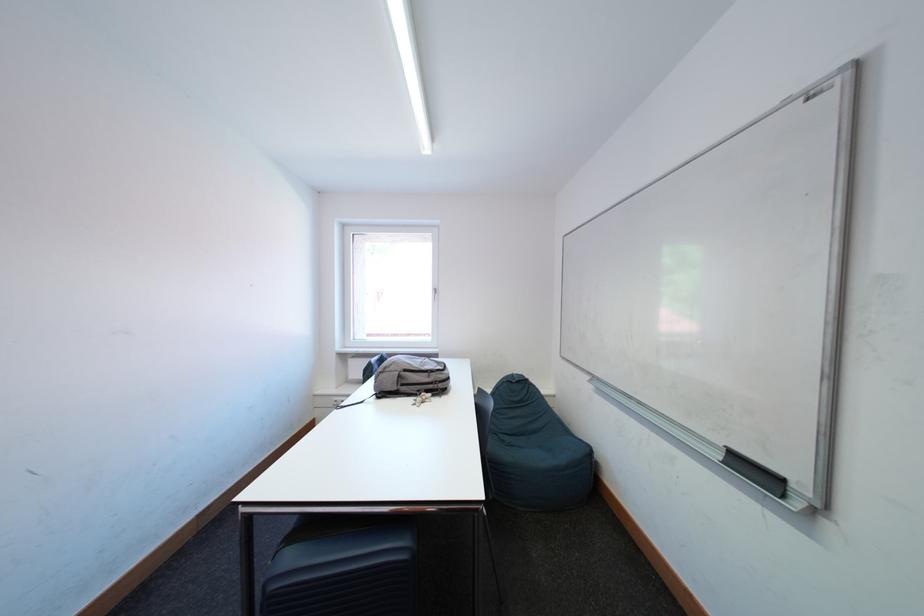
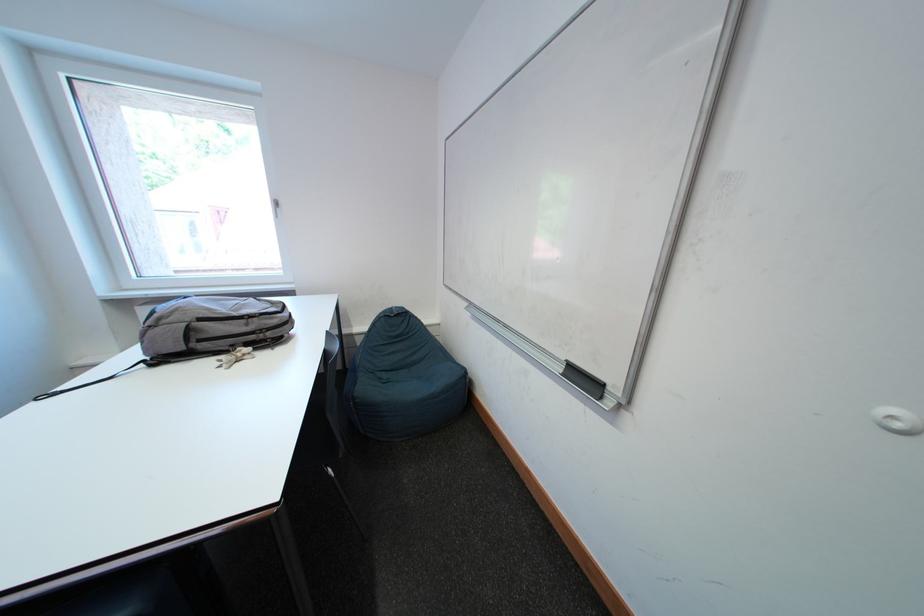
In a continuous first-person perspective shot, in which direction is the camera moving?

The movement direction of the cameraman is right, forward.